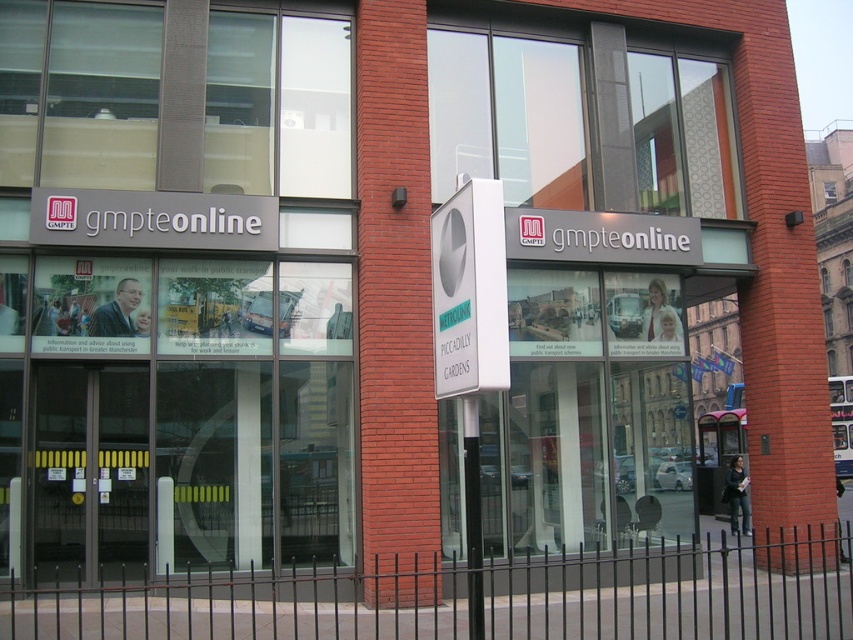
Does white plastic sign at center have a smaller size compared to black plastic pole at center?

No, white plastic sign at center is not smaller than black plastic pole at center.

Image resolution: width=853 pixels, height=640 pixels. Find the location of `white plastic sign at center`. white plastic sign at center is located at coordinates (469, 291).